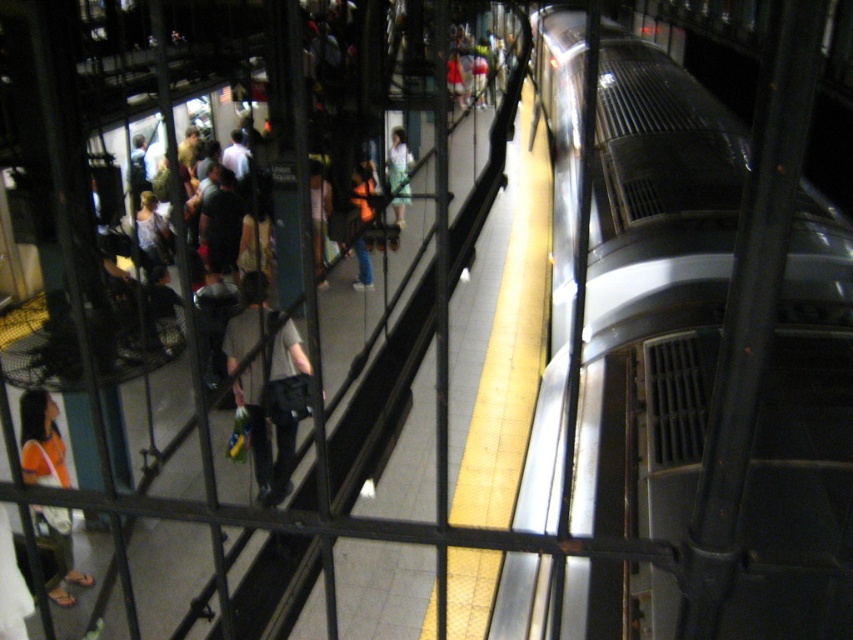
Question: Among these objects, which one is nearest to the camera?

Choices:
 (A) orange fabric shirt at lower left
 (B) light blue fabric dress at center
 (C) silver metallic train at right

Answer: (C)

Question: Which point is closer to the camera?

Choices:
 (A) orange fabric shirt at lower left
 (B) dark gray fabric bag at center
 (C) silver metallic train at right
 (D) light blue fabric dress at center

Answer: (C)

Question: Is orange fabric shirt at lower left behind light blue fabric dress at center?

Choices:
 (A) no
 (B) yes

Answer: (A)

Question: Which point is closer to the camera taking this photo?

Choices:
 (A) (55, 426)
 (B) (244, 340)
 (C) (403, 198)
 (D) (663, 147)

Answer: (D)

Question: Can you confirm if orange fabric shirt at lower left is positioned to the left of light blue fabric dress at center?

Choices:
 (A) no
 (B) yes

Answer: (B)

Question: Is silver metallic train at right further to camera compared to orange fabric shirt at lower left?

Choices:
 (A) yes
 (B) no

Answer: (B)